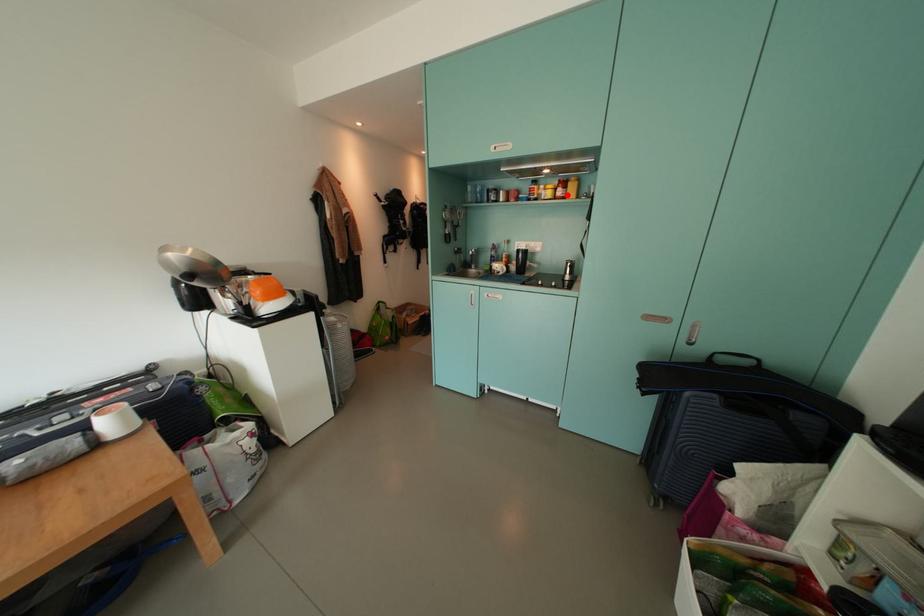
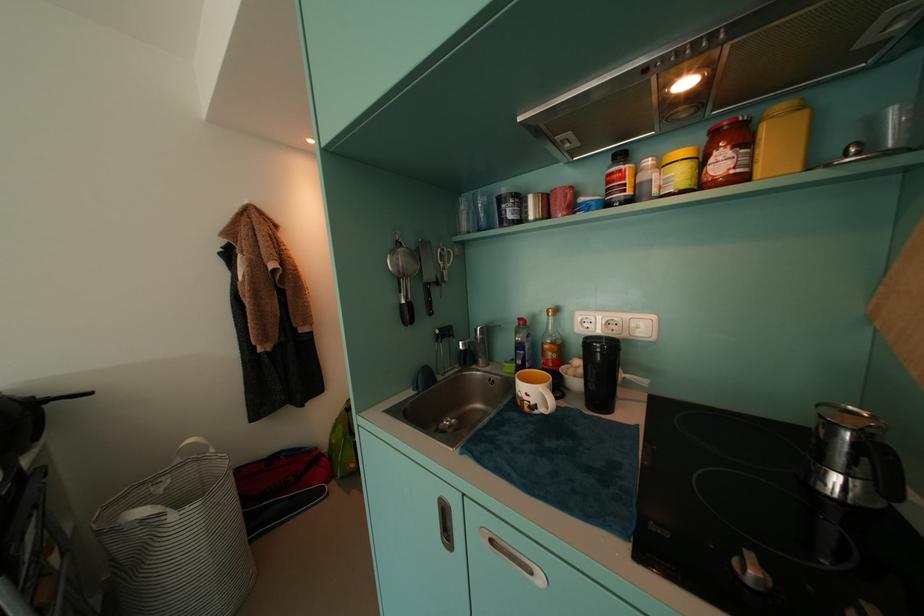
Locate, in the second image, the point that corresponds to the highlighted location in the first image.

(730, 166)